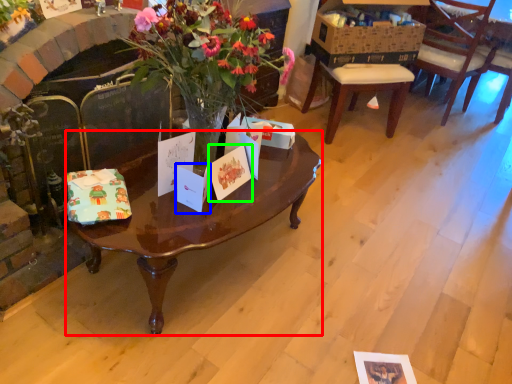
Question: Which is nearer to the coffee table (highlighted by a red box)? gift card (highlighted by a blue box) or gift card (highlighted by a green box).

Choices:
 (A) gift card
 (B) gift card

Answer: (B)